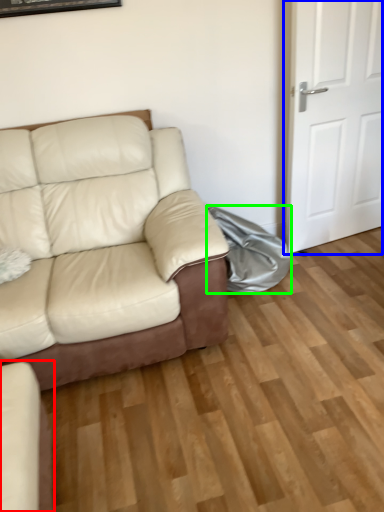
Question: Which object is the farthest from studio couch (highlighted by a red box)? Choose among these: door (highlighted by a blue box) or material (highlighted by a green box).

Choices:
 (A) door
 (B) material

Answer: (A)